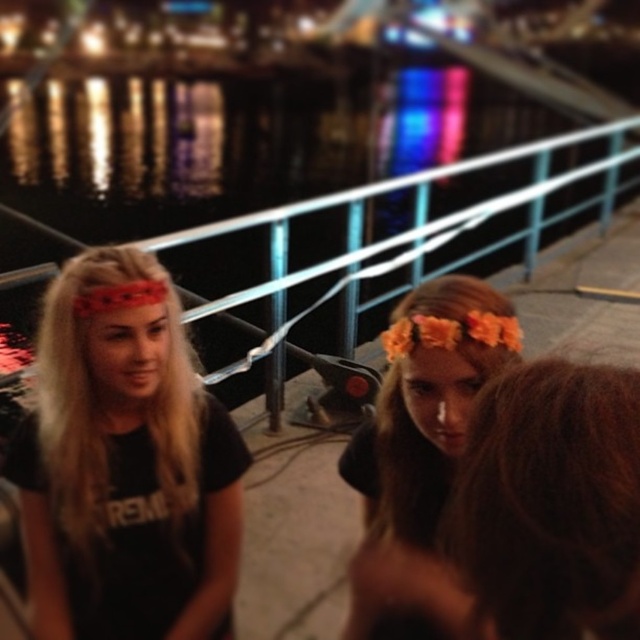
You are a photographer trying to capture a group photo of the matte black shirt at left and brown curly hair at center. Since you want to ensure both subjects are clearly visible, which subject should you focus on first considering their sizes?

The matte black shirt at left is wider than brown curly hair at center, so you should focus on the matte black shirt at left first to ensure it is clearly visible.

You are standing at the waterfront and want to walk towards the two points marked in the image. Which point, point (113,564) or point (419,371), will you reach first?

You will reach point (113,564) first because it is closer to you than point (419,371), which is further away.